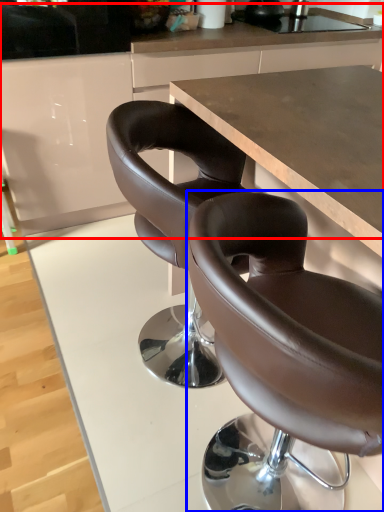
Question: Among these objects, which one is nearest to the camera, counter (highlighted by a red box) or chair (highlighted by a blue box)?

Choices:
 (A) counter
 (B) chair

Answer: (B)